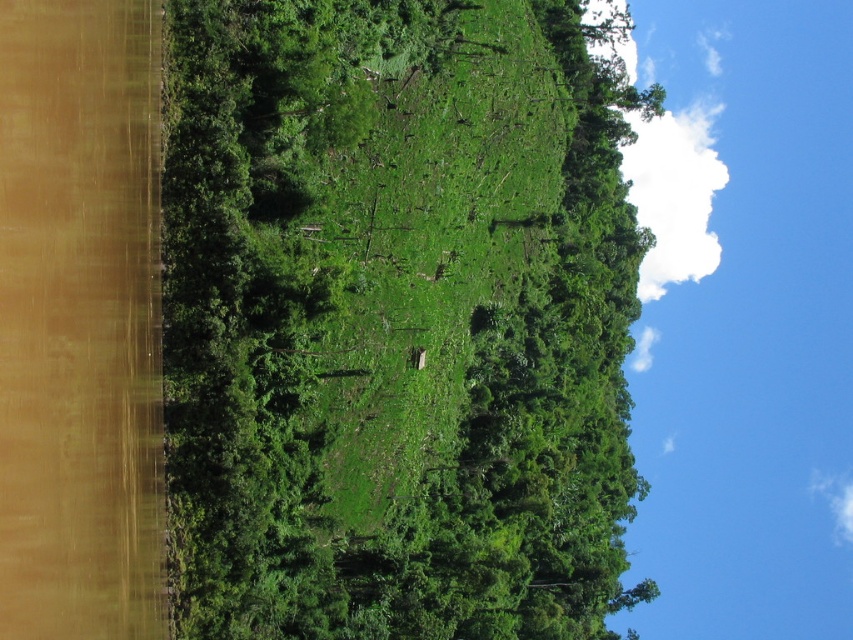
Who is more forward, (236, 593) or (338, 269)?

Positioned in front is point (338, 269).

Is point (521, 516) positioned in front of point (431, 481)?

No, (521, 516) is further to viewer.

Identify the location of green leafy tree at center. (396, 321).